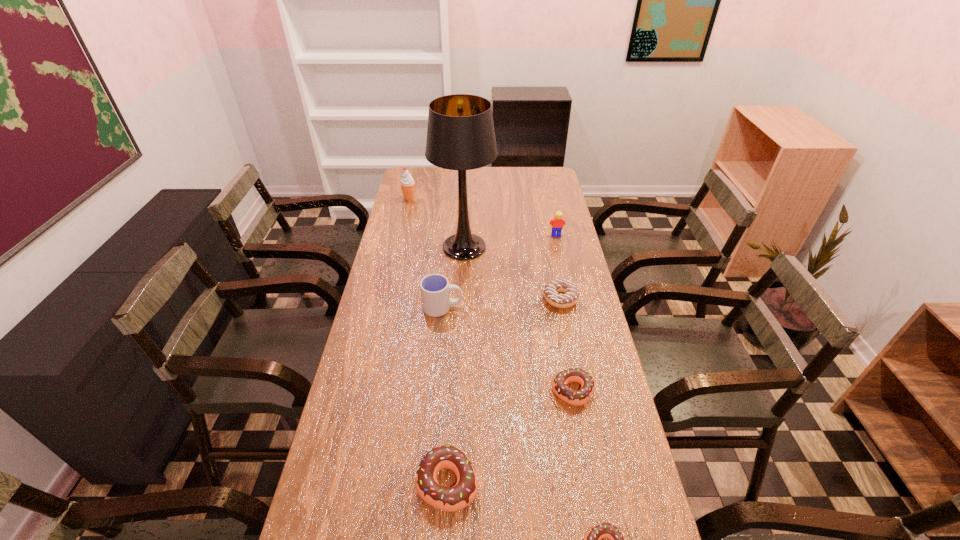
Where is `vacant position at the far edge of the desktop`? This screenshot has width=960, height=540. vacant position at the far edge of the desktop is located at coordinates (513, 190).

Find the location of a particular element. The height and width of the screenshot is (540, 960). vacant space at the left edge is located at coordinates (388, 447).

Image resolution: width=960 pixels, height=540 pixels. I want to click on vacant region at the right edge of the desktop, so click(604, 354).

At what (x,y) coordinates should I click in order to perform the action: click on empty space between the tallest object and the second tallest object. Please return your answer as a coordinate pair (x, y). This screenshot has height=540, width=960. Looking at the image, I should click on (437, 223).

You are a GUI agent. You are given a task and a screenshot of the screen. Output one action in this format:
    pyautogui.click(x=<x>, y=<y>)
    Task: Click on the empty space between the farthest doughnut and the fourth shortest object
    This screenshot has width=960, height=540.
    Given the screenshot: What is the action you would take?
    pyautogui.click(x=504, y=390)

I want to click on free space between the table lamp and the leftmost doughnut, so click(456, 364).

Identify the location of free point between the second farthest doughnut and the cup. The height and width of the screenshot is (540, 960). (508, 349).

You are a GUI agent. You are given a task and a screenshot of the screen. Output one action in this format:
    pyautogui.click(x=<x>, y=<y>)
    Task: Click on the blank region between the tallest object and the leftmost doughnut
    This screenshot has height=540, width=960.
    Given the screenshot: What is the action you would take?
    pyautogui.click(x=456, y=364)

Identify the location of object identified as the second closest to the third nearest object. (570, 297).

Choose which object is the third nearest neighbor to the table lamp. Please provide its 2D coordinates. Your answer should be formatted as a tuple, i.e. [(x, y)], where the tuple contains the x and y coordinates of a point satisfying the conditions above.

[(557, 223)]